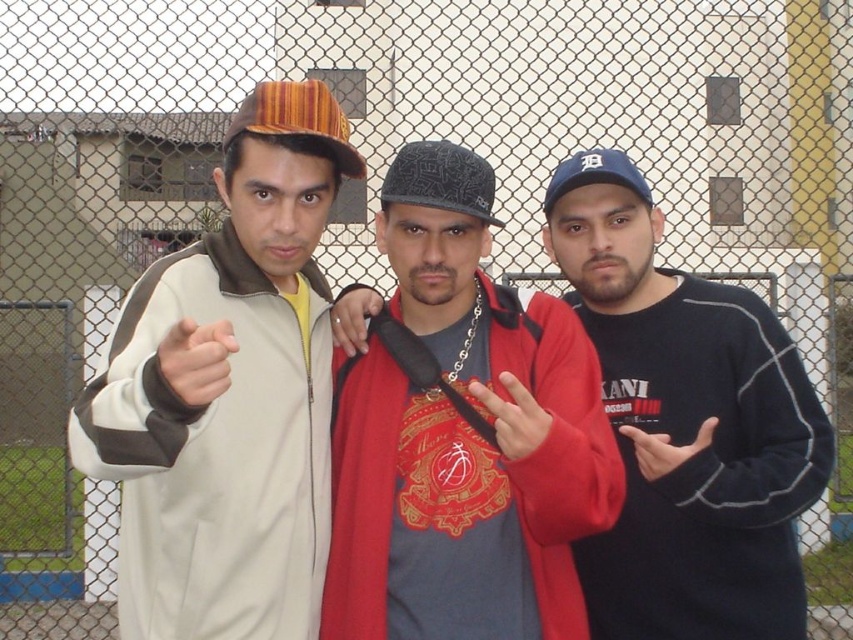
Can you confirm if red matte jacket at center is positioned below matte skin hand at center?

Yes, red matte jacket at center is below matte skin hand at center.

This screenshot has width=853, height=640. What do you see at coordinates (463, 436) in the screenshot?
I see `red matte jacket at center` at bounding box center [463, 436].

Locate an element on the screen. This screenshot has height=640, width=853. red matte jacket at center is located at coordinates (463, 436).

Is black matte sweatshirt at center behind matte skin hand at center?

Yes, black matte sweatshirt at center is further from the viewer.

Consider the image. Measure the distance from black matte sweatshirt at center to matte skin hand at center.

A distance of 12.79 meters exists between black matte sweatshirt at center and matte skin hand at center.

I want to click on black matte sweatshirt at center, so click(x=686, y=424).

Is the position of black matte sweatshirt at center less distant than that of striped fabric baseball cap at left?

Yes, it is.

Locate an element on the screen. This screenshot has width=853, height=640. black matte sweatshirt at center is located at coordinates (686, 424).

The height and width of the screenshot is (640, 853). What do you see at coordinates (686, 424) in the screenshot?
I see `black matte sweatshirt at center` at bounding box center [686, 424].

The image size is (853, 640). I want to click on black matte sweatshirt at center, so click(x=686, y=424).